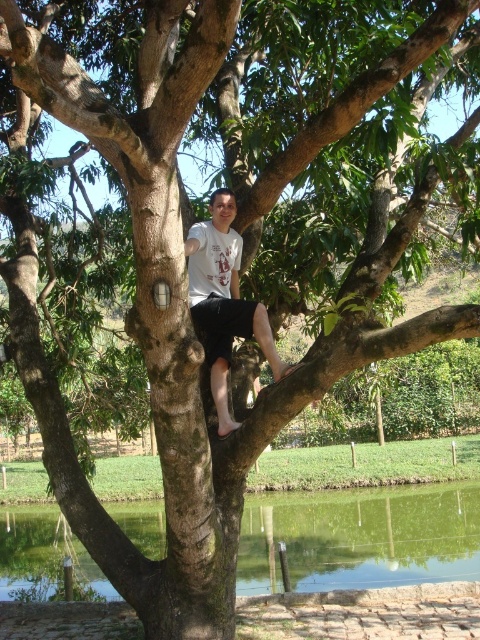
Question: In this image, where is green smooth water at lower center located relative to white cotton t-shirt at center?

Choices:
 (A) above
 (B) below

Answer: (B)

Question: Which point is farther to the camera?

Choices:
 (A) white cotton t-shirt at center
 (B) green smooth water at lower center

Answer: (B)

Question: In this image, where is green smooth water at lower center located relative to white cotton t-shirt at center?

Choices:
 (A) above
 (B) below

Answer: (B)

Question: Is green smooth water at lower center below white cotton t-shirt at center?

Choices:
 (A) no
 (B) yes

Answer: (B)